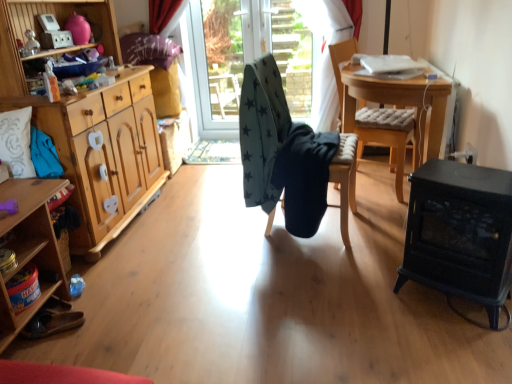
Where is `free location to the left of black cast iron fireplace at lower right`? free location to the left of black cast iron fireplace at lower right is located at coordinates (379, 301).